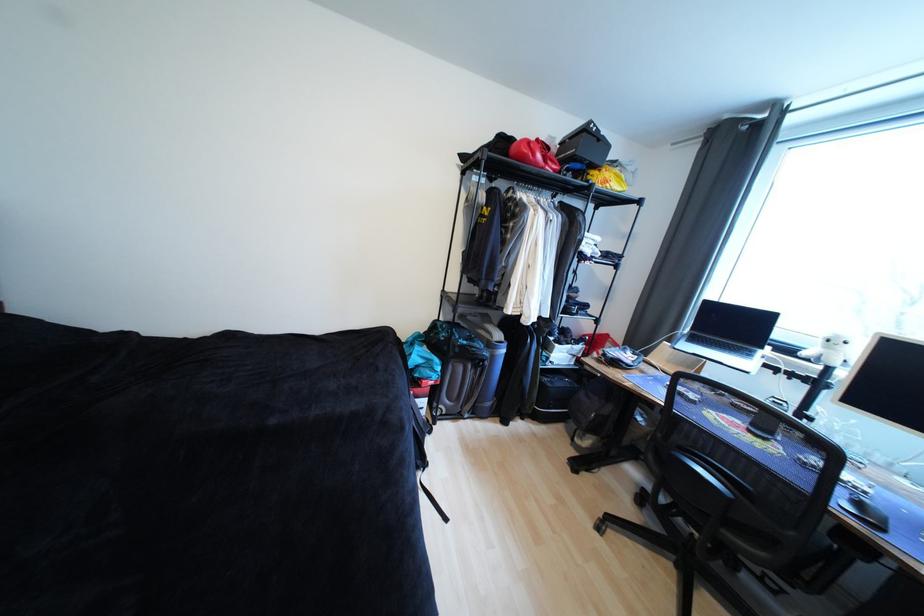
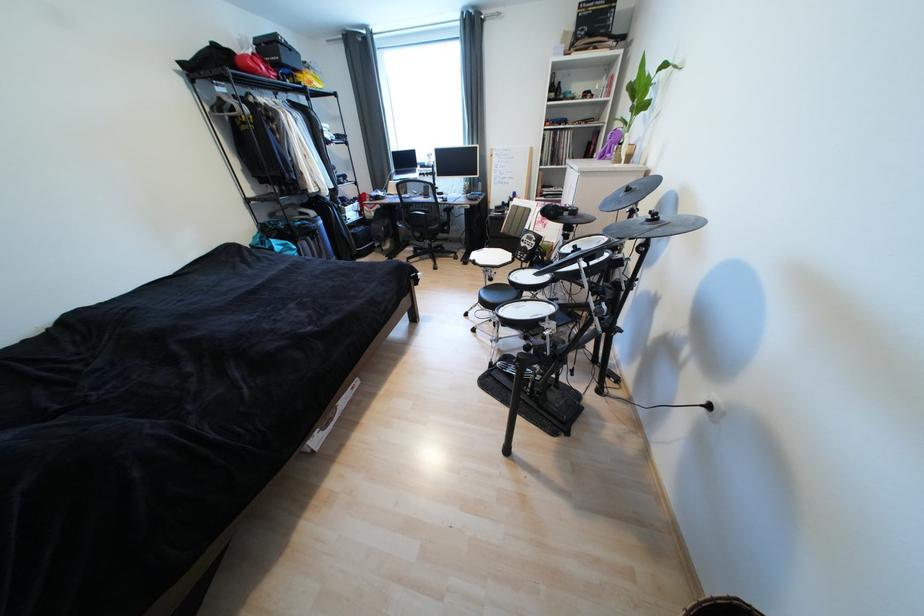
In the second image, find the point that corresponds to the point at 529,159 in the first image.

(261, 73)